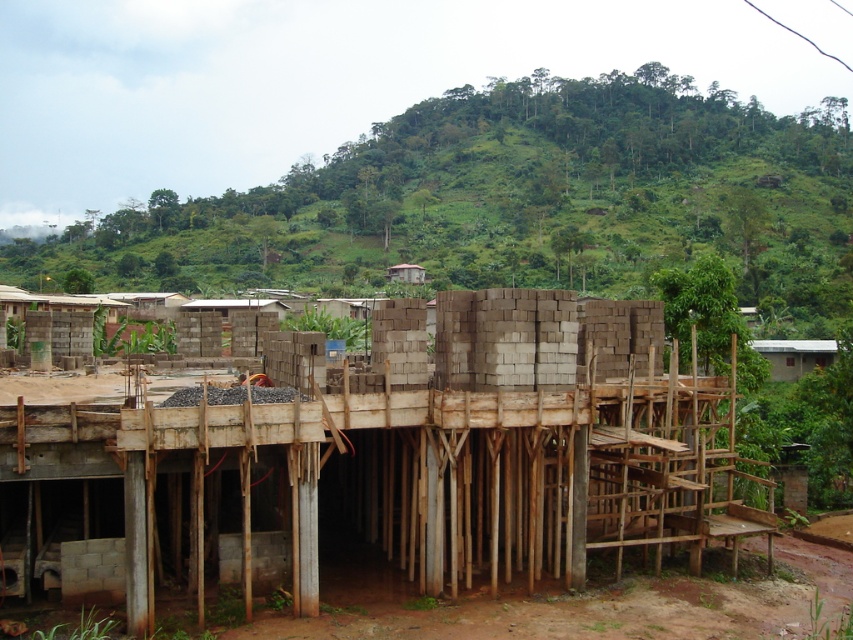
You are a construction worker who needs to move materials from the gray concrete foundation at lower left to the gray concrete blocks at center. Which object requires more effort to move due to its size?

The gray concrete blocks at center requires more effort to move due to its larger size compared to the gray concrete foundation at lower left.

You are a construction worker carrying a heavy tool box. You need to move from the gray concrete foundation at lower left to the gray concrete blocks at center. Considering the distance between them, is it possible to walk directly between them without needing to go around any obstacles?

The gray concrete blocks at center is 6.95 meters from gray concrete foundation at lower left. Since there are no obstacles mentioned in the scene description between them, you can walk directly between them.